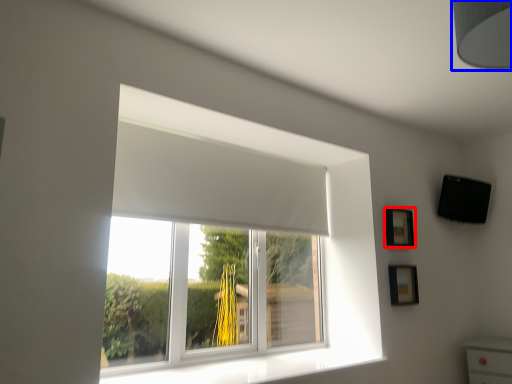
Question: Which of the following is the farthest to the observer, picture frame (highlighted by a red box) or lamp (highlighted by a blue box)?

Choices:
 (A) picture frame
 (B) lamp

Answer: (A)